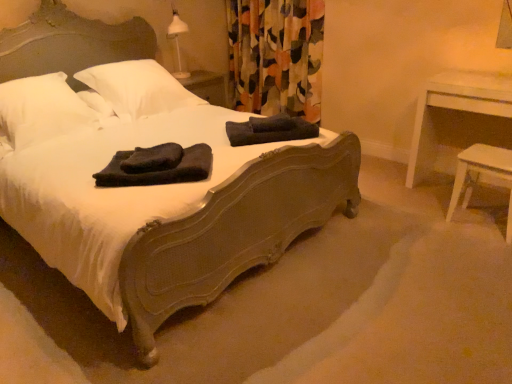
Question: Is black towel at center, arranged as the 2th material when viewed from the right, wider or thinner than matte dark wood bed at center?

Choices:
 (A) wide
 (B) thin

Answer: (B)

Question: Is black towel at center, positioned as the second material in back-to-front order, spatially inside matte dark wood bed at center, or outside of it?

Choices:
 (A) outside
 (B) inside

Answer: (B)

Question: Considering the real-world distances, which object is farthest from the matte dark wood bed at center?

Choices:
 (A) white soft pillow at upper left, which is the 1th pillow in right-to-left order
 (B) white wood stool at lower right
 (C) multicolored fabric curtain at upper center
 (D) dark cotton towels at center, the first material in the top-to-bottom sequence
 (E) white wood table at right

Answer: (C)

Question: Which is farther from the white wood table at right?

Choices:
 (A) white soft pillow at upper left, acting as the second pillow starting from the right
 (B) multicolored fabric curtain at upper center
 (C) white wood stool at lower right
 (D) dark cotton towels at center, placed as the second material when sorted from bottom to top
 (E) matte dark wood bed at center

Answer: (A)